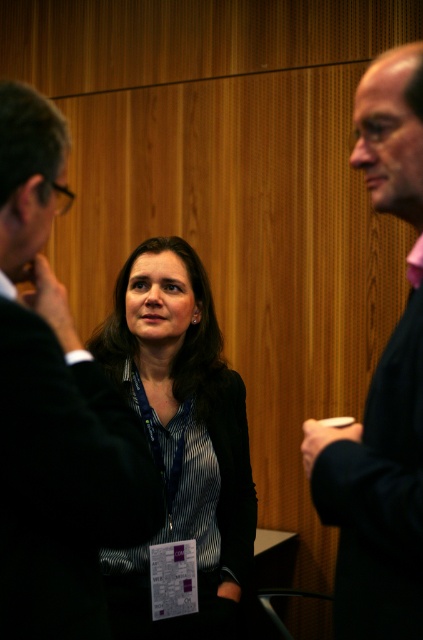
You are a photographer setting up for a group photo. You need to arrange the matte black suit at left and the pink fabric shirt at right so that both are fully visible in the frame. Given their height difference, which object should be positioned closer to the camera to ensure both are visible without cropping?

The matte black suit at left is shorter than the pink fabric shirt at right. To ensure both are fully visible, position the shorter matte black suit at left closer to the camera so that its height matches the taller pink fabric shirt at right in the frame.

You are standing at the camera position and want to reach the point at coordinates (x=33, y=308). Is this point within your immediate reach without moving your feet?

The point at coordinates (x=33, y=308) is 3.47 feet away from the camera, so it is within immediate reach without moving your feet.

You are organizing a photo shoot and need to ensure that the matte black blazer at center and the pink fabric shirt at right are visible in the frame. Based on their sizes, which one might require more space in the composition?

The matte black blazer at center requires more space in the composition because its width is larger than the pink fabric shirt at right.